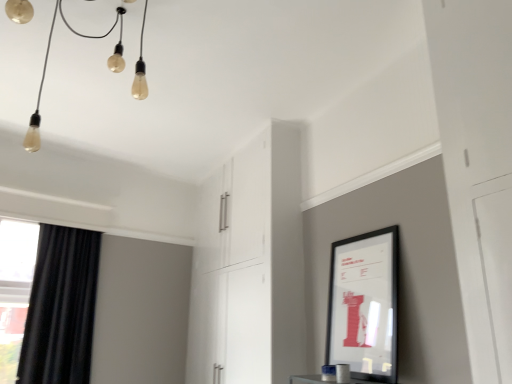
Question: Is black matte picture frame at upper right taller than black velvet curtain at left?

Choices:
 (A) yes
 (B) no

Answer: (B)

Question: Can you confirm if black matte picture frame at upper right is wider than black velvet curtain at left?

Choices:
 (A) yes
 (B) no

Answer: (B)

Question: From the image's perspective, would you say black matte picture frame at upper right is positioned over black velvet curtain at left?

Choices:
 (A) yes
 (B) no

Answer: (A)

Question: Considering the relative sizes of black matte picture frame at upper right and black velvet curtain at left in the image provided, is black matte picture frame at upper right smaller than black velvet curtain at left?

Choices:
 (A) yes
 (B) no

Answer: (A)

Question: From a real-world perspective, is black matte picture frame at upper right beneath black velvet curtain at left?

Choices:
 (A) yes
 (B) no

Answer: (A)

Question: Is point (230, 355) positioned closer to the camera than point (81, 370)?

Choices:
 (A) closer
 (B) farther

Answer: (A)

Question: In the image, is white glossy cabinet at center positioned in front of or behind black velvet curtain at left?

Choices:
 (A) behind
 (B) front

Answer: (B)

Question: In terms of width, does white glossy cabinet at center look wider or thinner when compared to black velvet curtain at left?

Choices:
 (A) thin
 (B) wide

Answer: (B)

Question: Choose the correct answer: Is white glossy cabinet at center inside black velvet curtain at left or outside it?

Choices:
 (A) outside
 (B) inside

Answer: (A)

Question: Is white glossy cabinet at center wider or thinner than matte glass lightbulbs at upper left?

Choices:
 (A) thin
 (B) wide

Answer: (A)

Question: From a real-world perspective, is white glossy cabinet at center above or below matte glass lightbulbs at upper left?

Choices:
 (A) above
 (B) below

Answer: (B)

Question: In terms of height, does white glossy cabinet at center look taller or shorter compared to matte glass lightbulbs at upper left?

Choices:
 (A) tall
 (B) short

Answer: (A)

Question: From the image's perspective, relative to matte glass lightbulbs at upper left, is white glossy cabinet at center above or below?

Choices:
 (A) above
 (B) below

Answer: (B)

Question: Does point (26, 324) appear closer or farther from the camera than point (373, 374)?

Choices:
 (A) closer
 (B) farther

Answer: (B)

Question: Is black velvet curtain at left spatially inside black matte picture frame at upper right, or outside of it?

Choices:
 (A) outside
 (B) inside

Answer: (A)